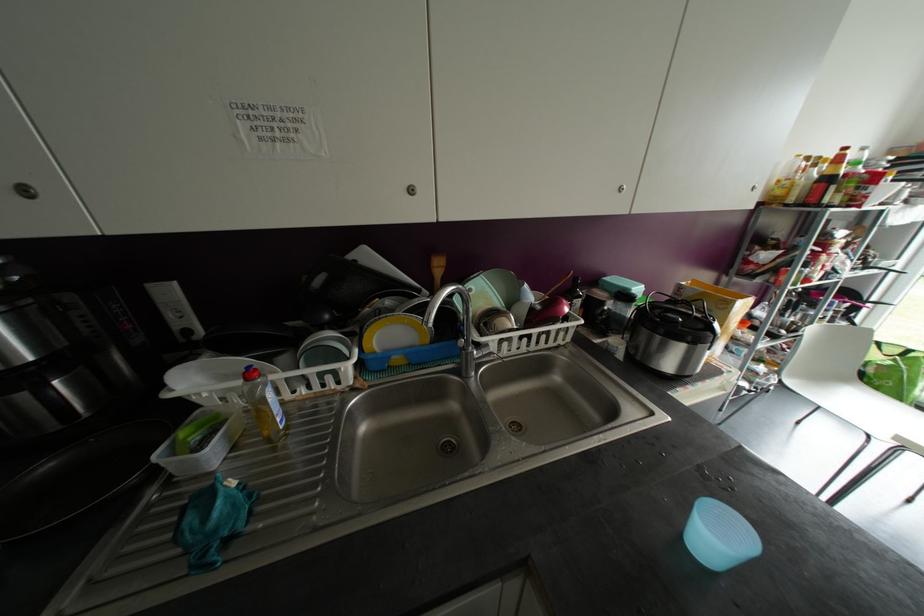
This screenshot has height=616, width=924. I want to click on faucet handle, so click(493, 354).